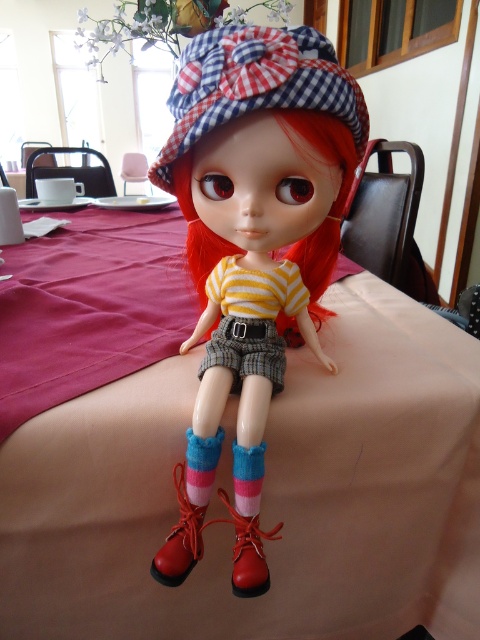
You are standing at the position of the doll and looking towards the dining table. Which of the two points, point (199, 424) or point (232, 364), is closer to you?

Point (199, 424) is in front of point (232, 364), so it is closer to you.

You are arranging items on the beige fabric table at center. You have a pair of knitted pink and blue socks at lower center. If you want to place the socks on the table, will they fit entirely on the table without overlapping the edges?

The beige fabric table at center is wider than the knitted pink and blue socks at lower center, so the socks will fit entirely on the table without overlapping the edges.

You are standing in the dining area looking at the table. There are two points marked on the table surface. Which point is closer to you, point (195,509) or point (238,522)?

Point (195,509) is further to the viewer than point (238,522), so the closer point to you is point (238,522).